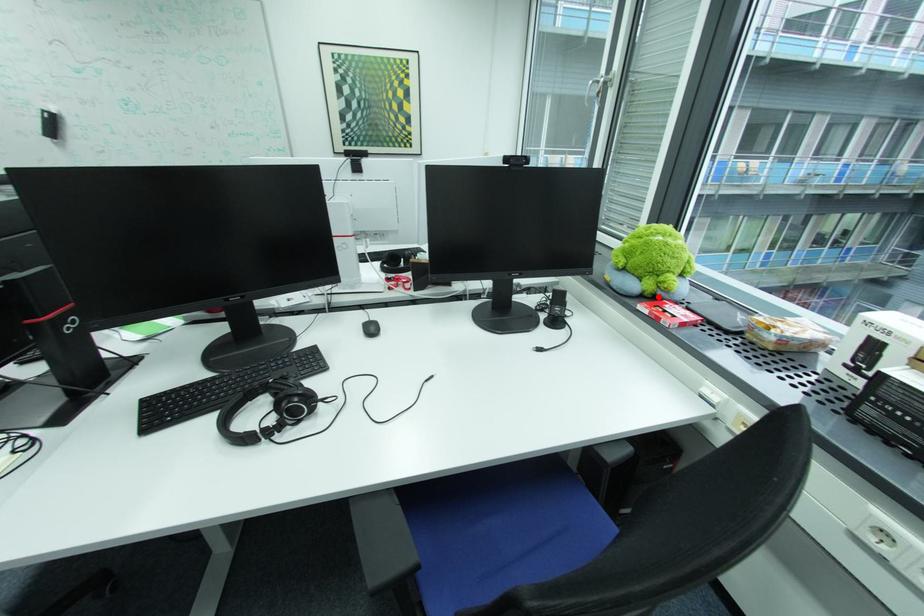
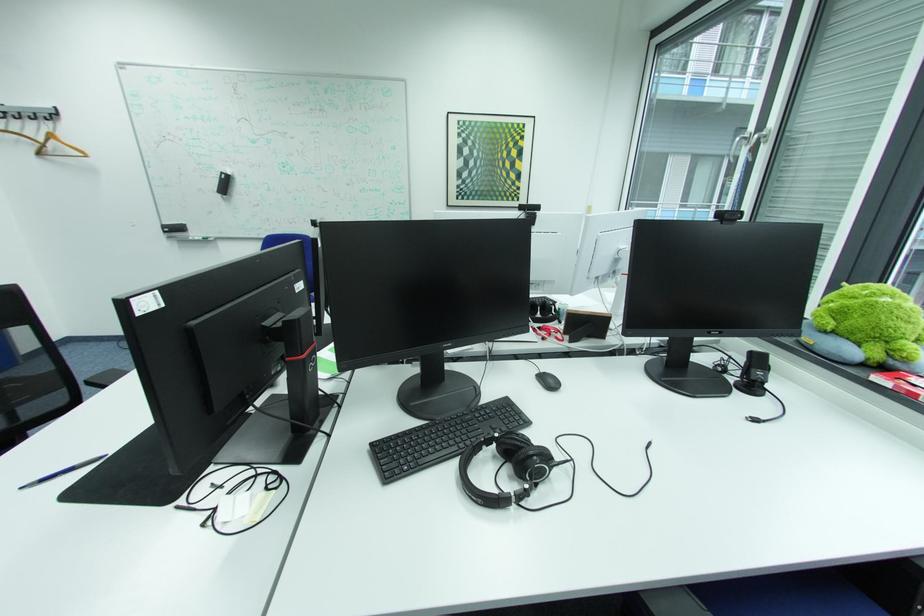
Locate, in the second image, the point that corresponds to the highlighted location in the first image.

(882, 365)